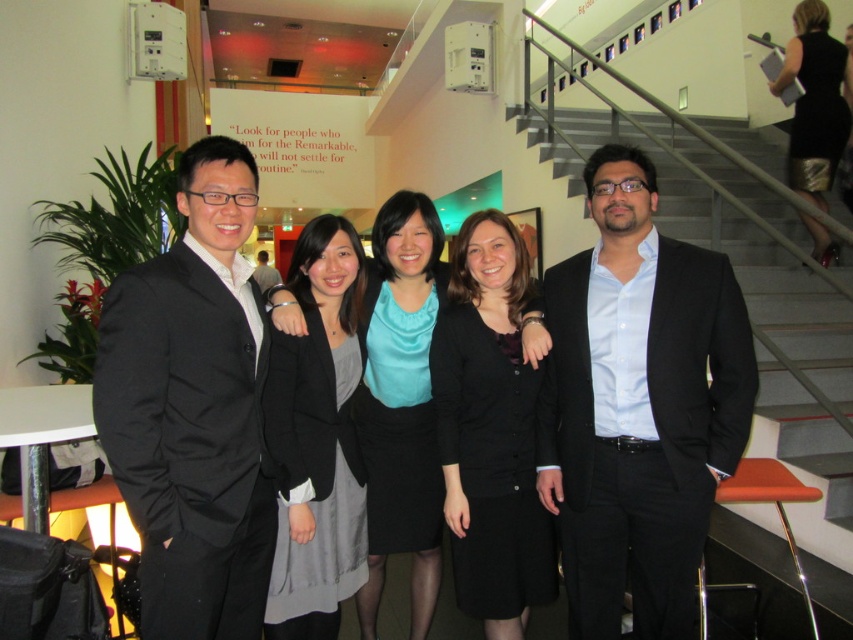
Looking at this image, does matte black suit at right appear on the right side of matte black blazer at center?

Indeed, matte black suit at right is positioned on the right side of matte black blazer at center.

Which of these two, matte black suit at right or matte black blazer at center, stands taller?

matte black suit at right is taller.

Does point (692, 396) come behind point (320, 310)?

No.

This screenshot has height=640, width=853. In order to click on matte black suit at right in this screenshot , I will do `click(637, 404)`.

Does matte teal blouse at center appear under gold metallic skirt at upper right?

Yes, matte teal blouse at center is below gold metallic skirt at upper right.

Who is more forward, (421, 428) or (824, 29)?

Point (421, 428) is more forward.

Locate an element on the screen. The width and height of the screenshot is (853, 640). matte teal blouse at center is located at coordinates (402, 403).

Is matte black suit at left smaller than black matte cardigan at center?

No.

Is matte black suit at left taller than black matte cardigan at center?

No.

Identify the location of matte black suit at left. (192, 408).